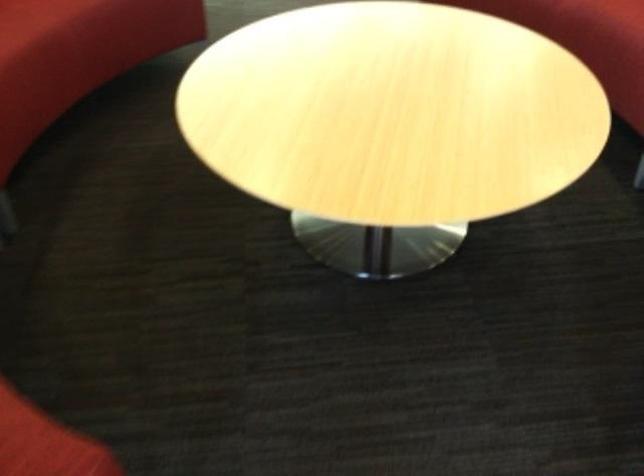
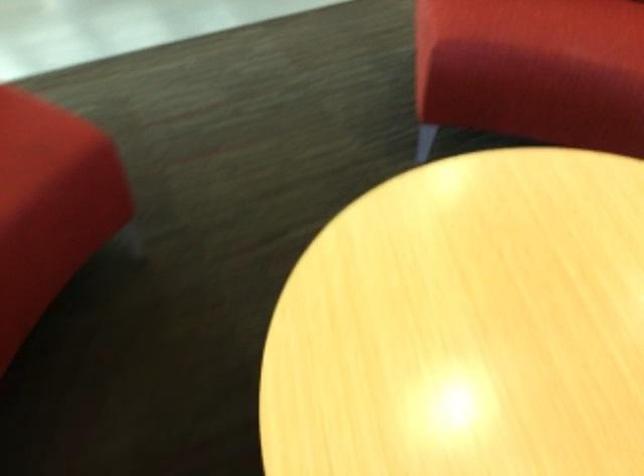
The images are taken continuously from a first-person perspective. In which direction is your viewpoint rotating?

The camera's rotation is toward right-down.